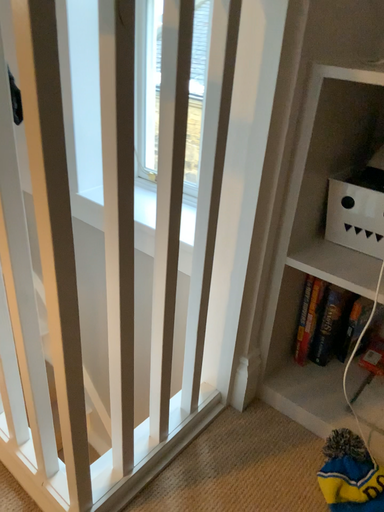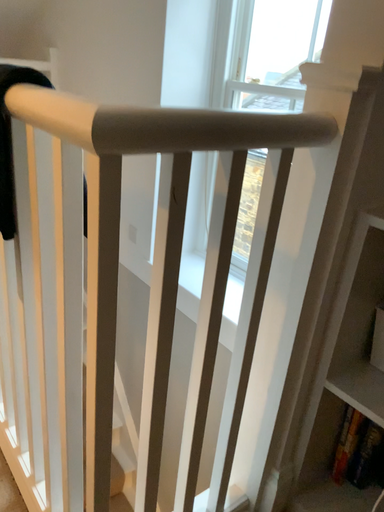
Question: How did the camera likely rotate when shooting the video?

Choices:
 (A) rotated left
 (B) rotated right

Answer: (A)